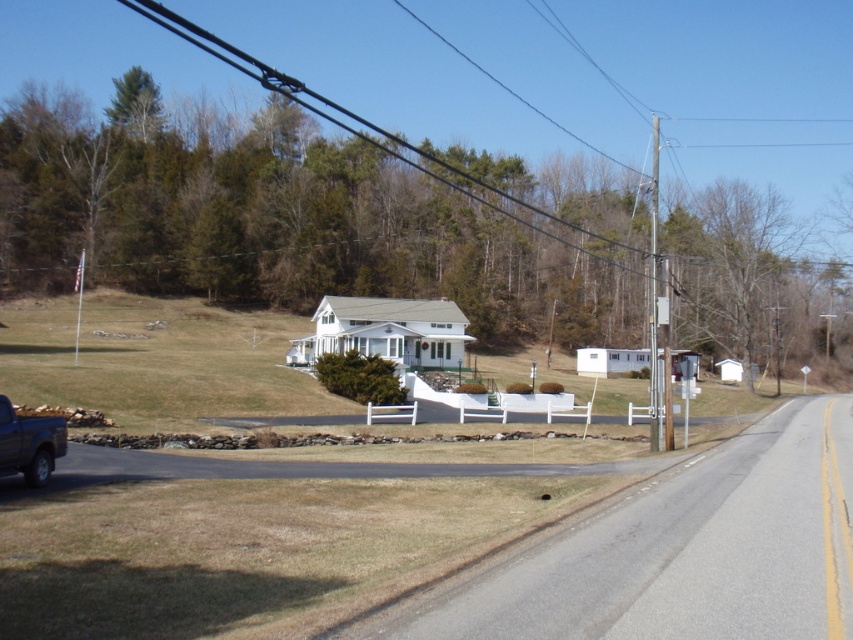
You are standing at the point marked as point [376,147] in the image. The paved road curves gently to the right. If you want to walk directly towards the house, which direction should you turn first?

Since the point [376,147] is 129.37 meters away from the viewer, you should turn left to face the house.

You are a delivery driver approaching the house and need to park your dark gray metallic truck at lower left. There is a black wire at upper center that might interfere with your truck. Can you park your truck without hitting the wire?

The black wire at upper center is bigger than dark gray metallic truck at lower left, so it is likely taller or wider. However, since the truck is at lower left and the wire is at upper center, the vertical distance between them should allow the truck to park without hitting the wire. But the horizontal proximity needs to be assessed. Since the wire is bigger, it might extend closer to the truck, posing a collision risk. Without exact dimensions, it is unsafe to park there.